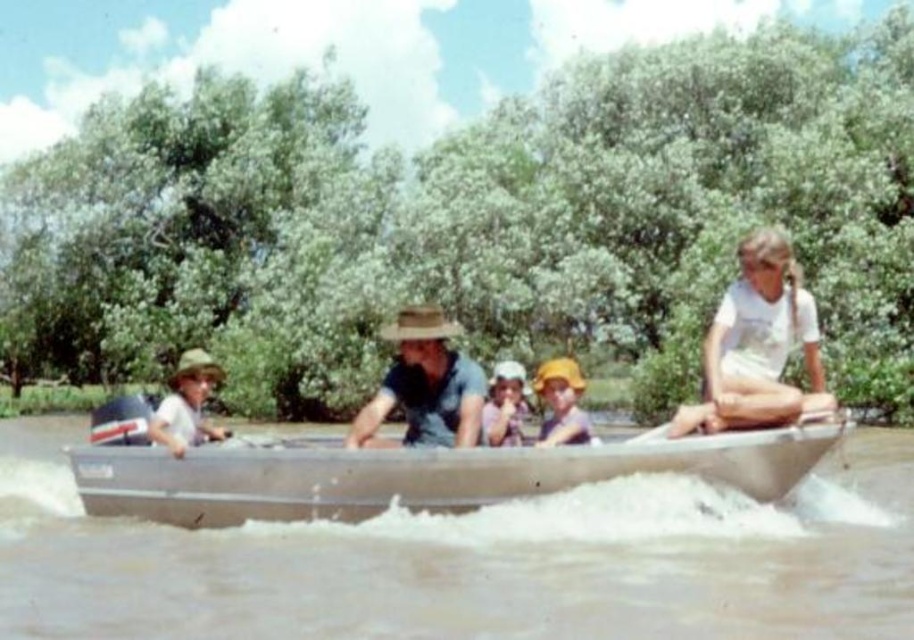
Between white cotton shirt at right and brown woven hat at center, which one is positioned lower?

Positioned lower is brown woven hat at center.

The width and height of the screenshot is (914, 640). What do you see at coordinates (757, 344) in the screenshot?
I see `white cotton shirt at right` at bounding box center [757, 344].

Find the location of a particular element. This screenshot has width=914, height=640. white cotton shirt at right is located at coordinates (757, 344).

Locate an element on the screen. The height and width of the screenshot is (640, 914). brown woven hat at center is located at coordinates (424, 385).

Does brown woven hat at center appear on the right side of pink fabric hat at center?

Incorrect, brown woven hat at center is not on the right side of pink fabric hat at center.

Is point (473, 385) farther from camera compared to point (509, 440)?

No, (473, 385) is in front of (509, 440).

This screenshot has width=914, height=640. What are the coordinates of `brown woven hat at center` in the screenshot? It's located at (424, 385).

Which is more to the right, brushed metal boat at center or brown woven hat at center?

Positioned to the right is brushed metal boat at center.

Between point (659, 524) and point (358, 412), which one is positioned behind?

Point (358, 412)

Find the location of a particular element. The width and height of the screenshot is (914, 640). brushed metal boat at center is located at coordinates coord(473,561).